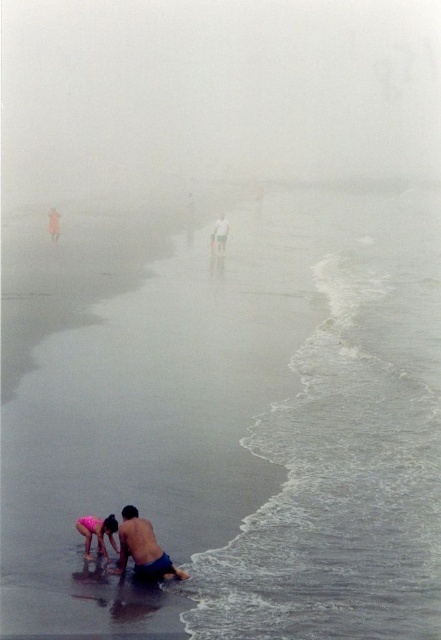
Between point (100, 547) and point (216, 224), which one is positioned in front?

Point (100, 547)

Is pink fabric at lower left bigger than smooth white man at center?

Incorrect, pink fabric at lower left is not larger than smooth white man at center.

What do you see at coordinates (97, 532) in the screenshot? This screenshot has height=640, width=441. I see `pink fabric at lower left` at bounding box center [97, 532].

At what (x,y) coordinates should I click in order to perform the action: click on pink fabric at lower left. Please return your answer as a coordinate pair (x, y). The width and height of the screenshot is (441, 640). Looking at the image, I should click on (97, 532).

Can you confirm if foggy white at upper center is shorter than blue fabric shorts at lower center?

Incorrect, foggy white at upper center's height does not fall short of blue fabric shorts at lower center's.

Locate an element on the screen. The image size is (441, 640). foggy white at upper center is located at coordinates (217, 90).

Which is below, foggy white at upper center or smooth white man at center?

Positioned lower is smooth white man at center.

Does point (243, 108) lie behind point (224, 216)?

Yes.

The image size is (441, 640). I want to click on foggy white at upper center, so click(217, 90).